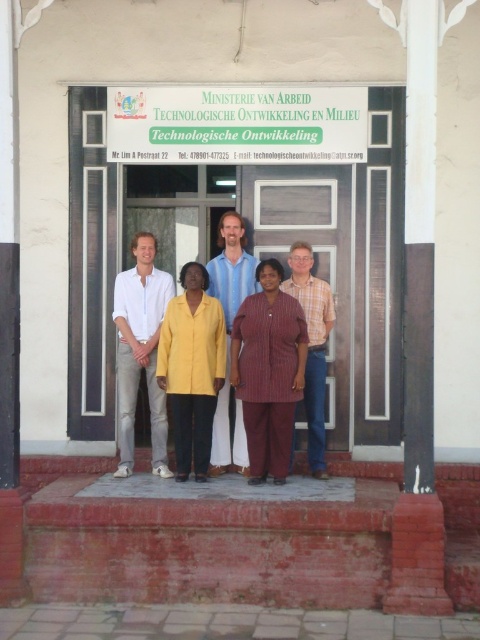
You are a photographer at the event and need to ensure that both the maroon striped dress at center and the plaid fabric shirt at center are fully visible in the photo. Given their height differences, which one might require adjusting the camera angle to avoid being cut off?

The maroon striped dress at center is shorter than the plaid fabric shirt at center, so the plaid fabric shirt at center is taller. To ensure both are fully visible, adjust the camera angle to account for the taller plaid fabric shirt at center to avoid it being cut off.

You are standing in front of the Ministry building and want to place a new sign that is the same height as the brick at lower center above the plaid fabric shirt at center. Is this possible?

The brick at lower center is below the plaid fabric shirt at center, so placing a sign with the same height as the brick above the plaid fabric shirt at center would require moving the plaid fabric shirt at center upwards, which isn not possible as they are fixed in position.

You are standing in front of the building entrance and want to place a small potted plant exactly where the brick at lower center is located. What are the coordinates of the spot where you should place the potted plant?

The coordinates for the brick at lower center are 0.848 on the x axis and 0.429 on the y axis. So you should place the potted plant at point (205, 541).